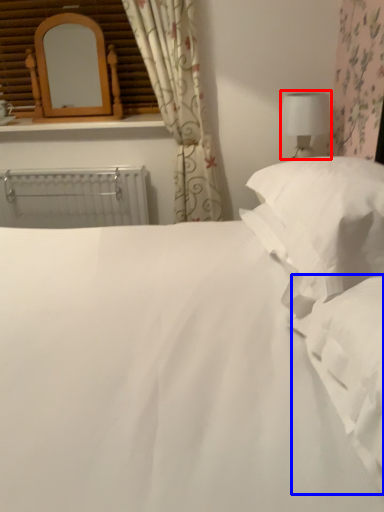
Question: Which of the following is the farthest to the observer, table lamp (highlighted by a red box) or sheet (highlighted by a blue box)?

Choices:
 (A) table lamp
 (B) sheet

Answer: (A)